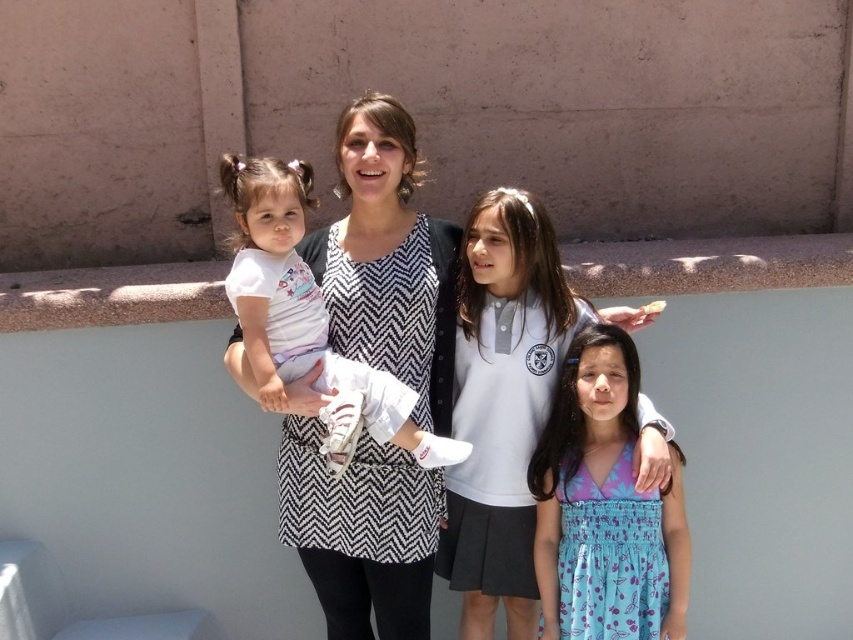
How far apart are white cotton polo shirt at center and white cotton shirt at left?

They are 16.92 inches apart.

Can you confirm if white cotton polo shirt at center is bigger than white cotton shirt at left?

Indeed, white cotton polo shirt at center has a larger size compared to white cotton shirt at left.

What do you see at coordinates (503, 403) in the screenshot?
I see `white cotton polo shirt at center` at bounding box center [503, 403].

I want to click on white cotton polo shirt at center, so coord(503,403).

Which is more to the right, white cotton polo shirt at center or blue floral dress at center?

blue floral dress at center

Is white cotton polo shirt at center smaller than blue floral dress at center?

No, white cotton polo shirt at center is not smaller than blue floral dress at center.

Locate an element on the screen. The width and height of the screenshot is (853, 640). white cotton polo shirt at center is located at coordinates pos(503,403).

Is white cotton shirt at center bigger than blue floral dress at center?

Yes.

Does white cotton shirt at center have a lesser height compared to blue floral dress at center?

No, white cotton shirt at center is not shorter than blue floral dress at center.

Which is behind, point (624, 323) or point (560, 502)?

The point (624, 323) is more distant.

Image resolution: width=853 pixels, height=640 pixels. Identify the location of white cotton shirt at center. (387, 259).